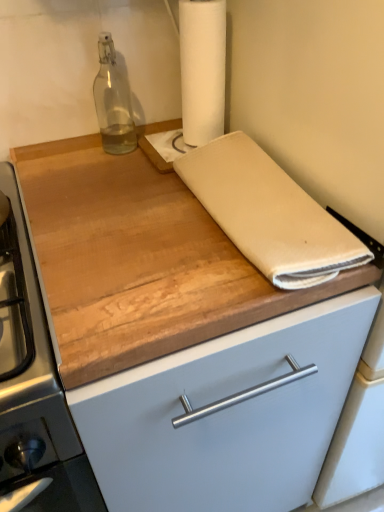
Image resolution: width=384 pixels, height=512 pixels. Find the location of `vacant area that lies to the right of transparent glass bottle at upper left`. vacant area that lies to the right of transparent glass bottle at upper left is located at coordinates (157, 141).